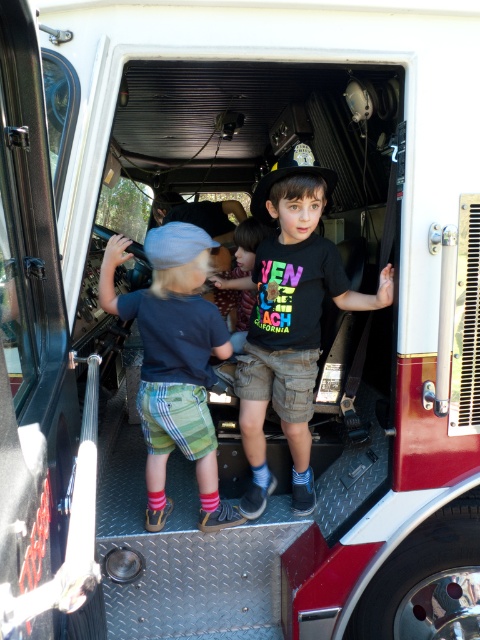
Question: Which point is closer to the camera taking this photo?

Choices:
 (A) (194, 448)
 (B) (262, 212)

Answer: (A)

Question: Does matte black shirt at center have a lesser width compared to matte blue shirt at center?

Choices:
 (A) yes
 (B) no

Answer: (B)

Question: Does matte black shirt at center appear on the right side of matte blue shirt at center?

Choices:
 (A) no
 (B) yes

Answer: (B)

Question: Is matte black shirt at center positioned in front of matte blue shirt at center?

Choices:
 (A) yes
 (B) no

Answer: (B)

Question: Which object is closer to the camera taking this photo?

Choices:
 (A) matte blue shirt at center
 (B) matte black shirt at center

Answer: (A)